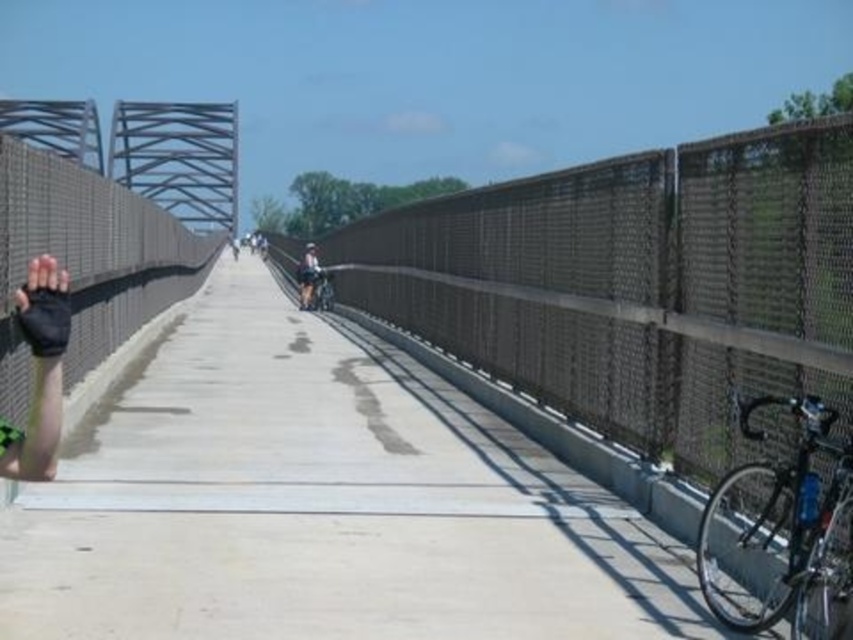
You are standing on the pedestrian bridge and see two points marked on the bridge surface. The first point is at coordinate point (570, 545) and the second point is at coordinate point (804, 449). If you are facing the direction of the bridge, which point is closer to you?

Point (804, 449) is closer to you because it is in front of point (570, 545).

You are standing at the point marked as point (94, 499) on the bridge. If you want to take a photo of the entire bridge from this position, will you be able to capture the entire structure in one shot without moving? Please explain your reasoning based on the distance between you and the camera.

The point (94, 499) and camera are 23.17 feet apart. Since the distance between you and the camera is 23.17 feet, it depends on the camera lens used. A wide angle lens might capture the entire bridge, while a standard lens might not. However, the question does not provide camera specifications, so we cannot definitively answer.

You are standing on the pedestrian bridge and want to place a small potted plant on the concrete at center. However, you also have a shiny silver bicycle at right that you need to park nearby. Considering their heights, which object should you place the potted plant on to ensure it is visible over the other?

The concrete at center has a lesser height compared to the shiny silver bicycle at right. To ensure the potted plant is visible over the bicycle, you should place it on the shiny silver bicycle at right since it is taller.